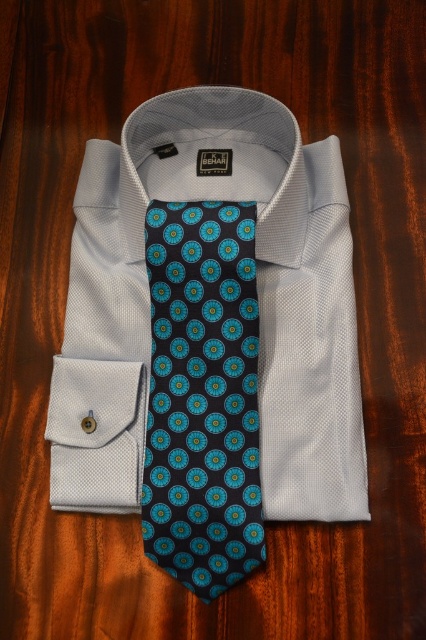
Is white textured dress shirt at center behind dark blue silk tie at center?

Yes, white textured dress shirt at center is behind dark blue silk tie at center.

Is point (160, 177) positioned before point (196, 337)?

No, it is not.

The image size is (426, 640). What are the coordinates of `white textured dress shirt at center` in the screenshot? It's located at (258, 301).